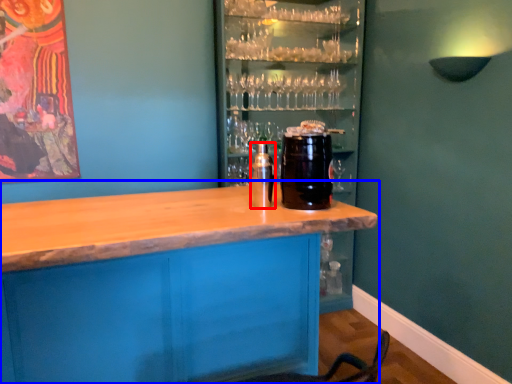
Question: Among these objects, which one is farthest to the camera, beverage (highlighted by a red box) or table (highlighted by a blue box)?

Choices:
 (A) beverage
 (B) table

Answer: (A)